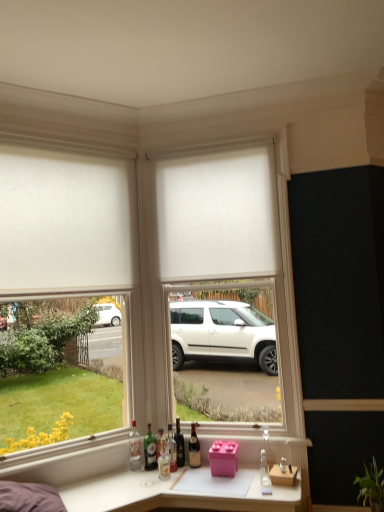
The width and height of the screenshot is (384, 512). I want to click on vacant area that is in front of brown glass bottle at center, marked as the 2th bottle in a right-to-left arrangement, so click(193, 475).